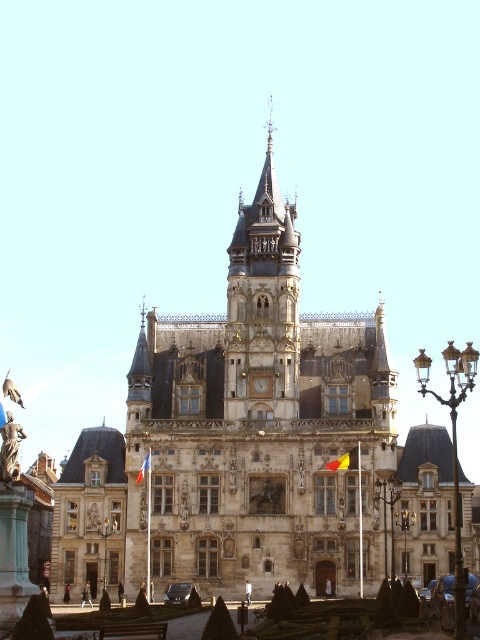
Question: Which point is farther to the camera?

Choices:
 (A) bronze statue at lower left
 (B) stone clock tower at center
 (C) yellow fabric flag at center
 (D) stone castle at center

Answer: (B)

Question: In this image, where is yellow fabric flag at center located relative to red fabric flag at center?

Choices:
 (A) left
 (B) right

Answer: (B)

Question: Can you confirm if stone clock tower at center is wider than bronze statue at lower left?

Choices:
 (A) yes
 (B) no

Answer: (A)

Question: Which object appears farthest from the camera in this image?

Choices:
 (A) red fabric flag at center
 (B) yellow fabric flag at center
 (C) stone clock tower at center
 (D) stone castle at center

Answer: (C)

Question: Is stone clock tower at center wider than yellow fabric flag at center?

Choices:
 (A) no
 (B) yes

Answer: (B)

Question: Which point is closer to the camera?

Choices:
 (A) (344, 461)
 (B) (156, 474)
 (C) (274, 384)

Answer: (A)